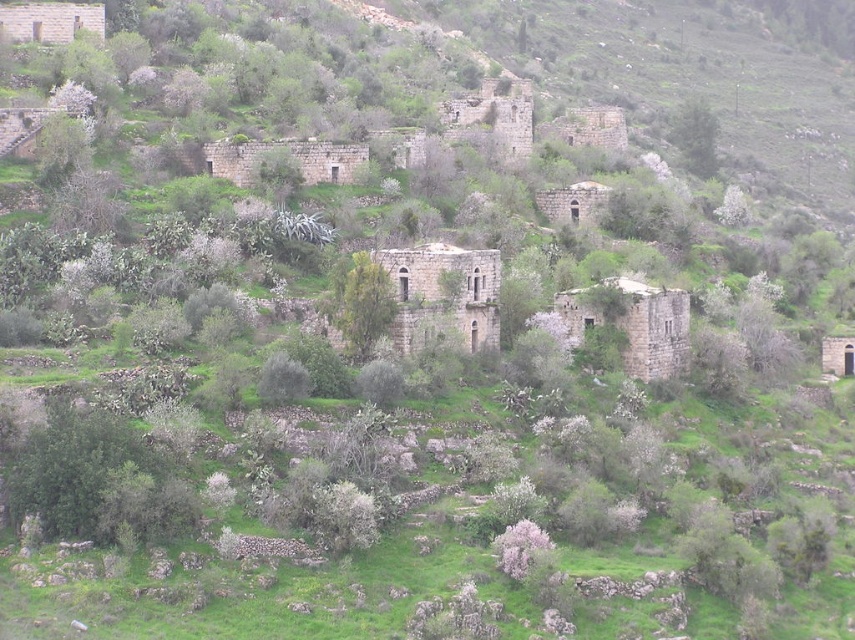
Question: Which object is closer to the camera taking this photo?

Choices:
 (A) green leafy tree at upper right
 (B) green leafy tree at center

Answer: (B)

Question: Which of the following is the closest to the observer?

Choices:
 (A) green leafy tree at upper right
 (B) green leafy tree at center

Answer: (B)

Question: Can you confirm if green leafy tree at center is positioned above green leafy tree at upper right?

Choices:
 (A) no
 (B) yes

Answer: (A)

Question: Which point appears farthest from the camera in this image?

Choices:
 (A) (373, 340)
 (B) (709, 109)

Answer: (B)

Question: Does green leafy tree at center lie behind green leafy tree at upper right?

Choices:
 (A) yes
 (B) no

Answer: (B)

Question: Does green leafy tree at center appear on the left side of green leafy tree at upper right?

Choices:
 (A) yes
 (B) no

Answer: (A)